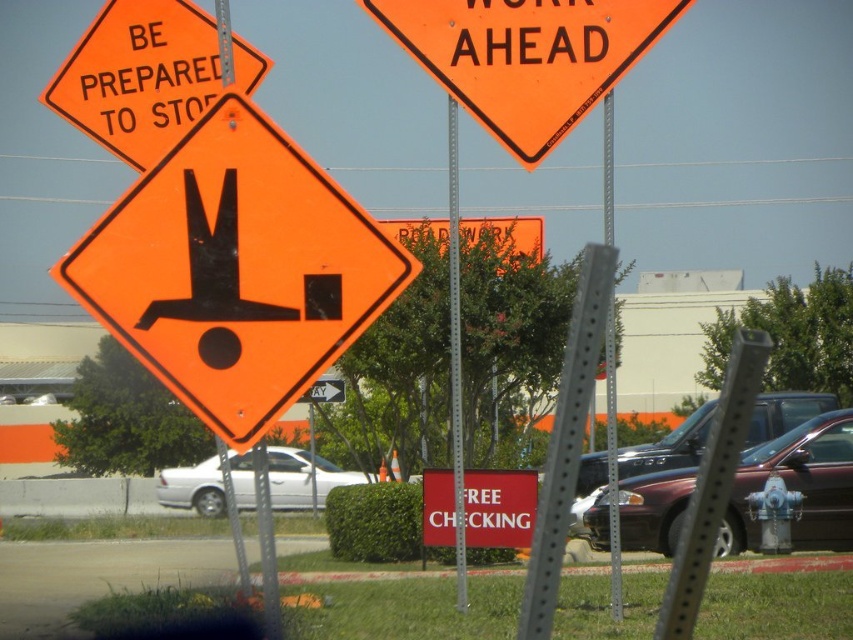
Question: Which point is closer to the camera taking this photo?

Choices:
 (A) (427, 486)
 (B) (601, 502)
 (C) (76, 104)
 (D) (527, 24)

Answer: (D)

Question: Where is orange reflective diamond at center located in relation to metallic silver pole at center in the image?

Choices:
 (A) below
 (B) above

Answer: (A)

Question: Can you confirm if orange reflective plastic sign at upper center is positioned above maroon metallic sedan at center-right?

Choices:
 (A) no
 (B) yes

Answer: (B)

Question: Which point is farther to the camera?

Choices:
 (A) (103, 292)
 (B) (103, 116)

Answer: (B)

Question: Where is orange reflective diamond at center located in relation to white glossy sedan at center in the image?

Choices:
 (A) below
 (B) above

Answer: (B)

Question: Which point is farther from the camera taking this photo?

Choices:
 (A) (201, 52)
 (B) (611, 296)
 (C) (512, 500)

Answer: (C)